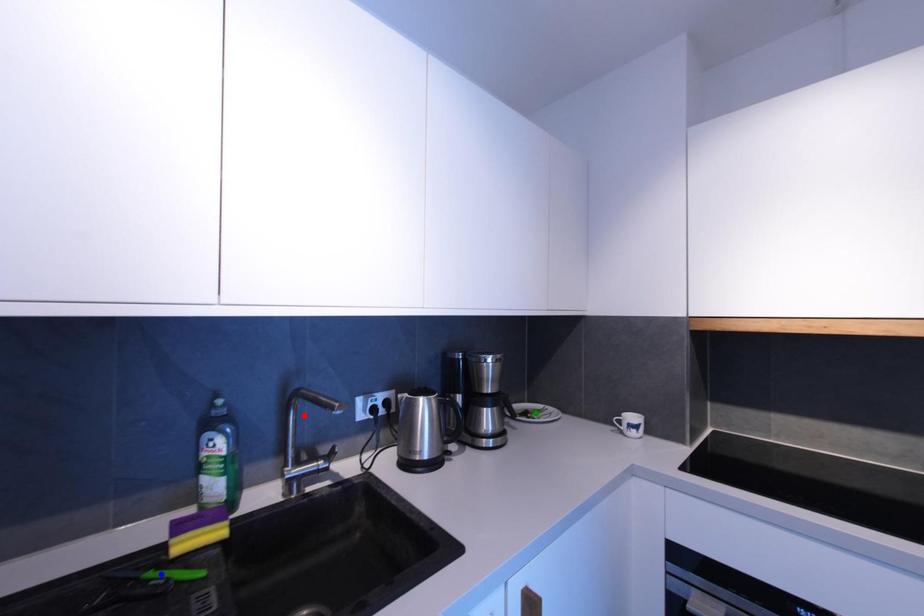
Order these from nearest to farthest:
- red point
- blue point
- green point

1. blue point
2. red point
3. green point